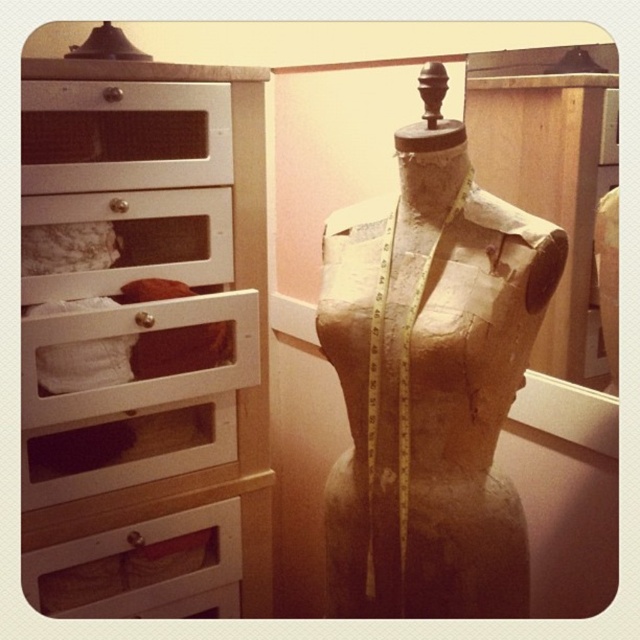
Is white wood dresser at left below white wood drawer at upper left?

Indeed, white wood dresser at left is positioned under white wood drawer at upper left.

How far apart are white wood dresser at left and white wood drawer at upper left?

white wood dresser at left is 8.32 inches from white wood drawer at upper left.

Which is in front, point (193, 528) or point (113, 164)?

Point (113, 164) is in front.

The height and width of the screenshot is (640, 640). Find the location of `white wood dresser at left`. white wood dresser at left is located at coordinates (148, 333).

Is point (230, 163) closer to viewer compared to point (403, 243)?

No, (230, 163) is further to viewer.

Between white wood dresser at left and burlap-like brown mannequin torso at center, which one is positioned lower?

white wood dresser at left

This screenshot has width=640, height=640. I want to click on white wood dresser at left, so click(148, 333).

This screenshot has height=640, width=640. Describe the element at coordinates (429, 381) in the screenshot. I see `burlap-like brown mannequin torso at center` at that location.

Who is more forward, [400,307] or [176,609]?

Point [400,307] is more forward.

At what (x,y) coordinates should I click in order to perform the action: click on burlap-like brown mannequin torso at center. Please return your answer as a coordinate pair (x, y). The height and width of the screenshot is (640, 640). Looking at the image, I should click on (429, 381).